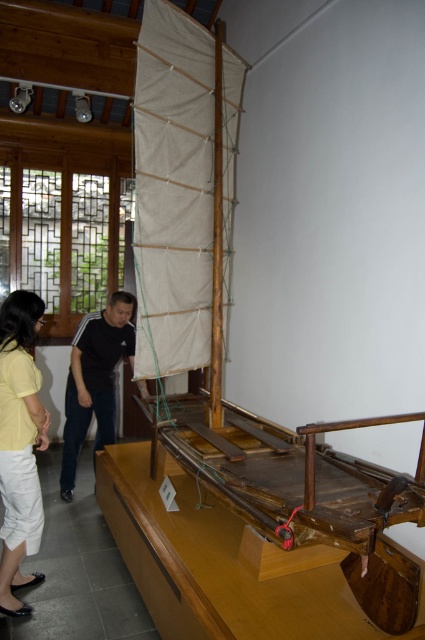
You are a museum visitor who wants to take a photo of the boat model. You notice two shirts hanging on a rack nearby. The yellow cotton shirt at lower left and the black cotton shirt at center. Which shirt is smaller in size?

The yellow cotton shirt at lower left is smaller in size compared to the black cotton shirt at center.

You are a visitor at the museum and notice two shirts displayed near the boat model. The yellow cotton shirt at lower left and the black cotton shirt at center. Which shirt is closer to you?

The yellow cotton shirt at lower left is closer to you because it is in front of the black cotton shirt at center.

You are a curator examining the model boat. You notice two points marked on the model. From your vantage point, which of the two points, point (23, 301) or point (119, 352), is closer to you?

Point (23, 301) is closer to the camera than point (119, 352).